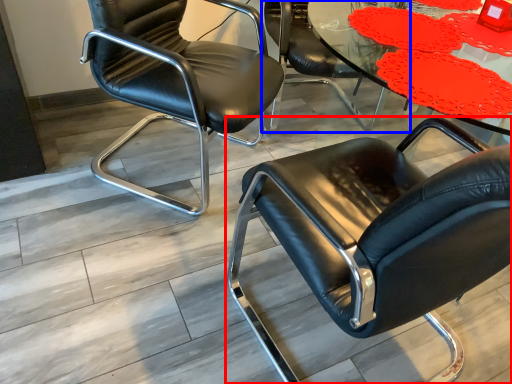
Question: Among these objects, which one is nearest to the camera, chair (highlighted by a red box) or chair (highlighted by a blue box)?

Choices:
 (A) chair
 (B) chair

Answer: (A)